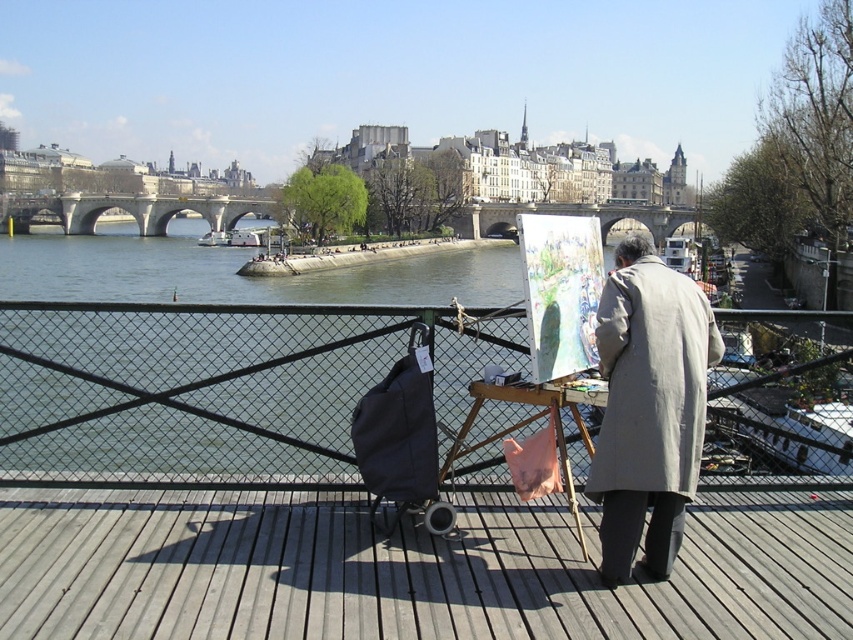
Is metal fence at center shorter than gray matte coat at right?

Correct, metal fence at center is not as tall as gray matte coat at right.

Does point (347, 442) lie in front of point (659, 387)?

No, it is behind (659, 387).

Is point (218, 401) more distant than point (643, 307)?

Yes, point (218, 401) is farther from viewer.

Find the location of a particular element. metal fence at center is located at coordinates (213, 381).

Does gray matte coat at right have a larger size compared to wooden easel at center?

Actually, gray matte coat at right might be smaller than wooden easel at center.

Can you confirm if gray matte coat at right is thinner than wooden easel at center?

Indeed, gray matte coat at right has a lesser width compared to wooden easel at center.

Does point (596, 497) come farther from viewer compared to point (583, 445)?

No, (596, 497) is in front of (583, 445).

Identify the location of gray matte coat at right. The image size is (853, 640). (653, 380).

Between point (283, 312) and point (570, 506), which one is positioned in front?

Point (570, 506) is more forward.

Who is more distant from viewer, (379, 333) or (560, 432)?

The point (379, 333) is more distant.

Which is behind, point (27, 376) or point (439, 477)?

Positioned behind is point (27, 376).

Where is `metal fence at center`? metal fence at center is located at coordinates (213, 381).